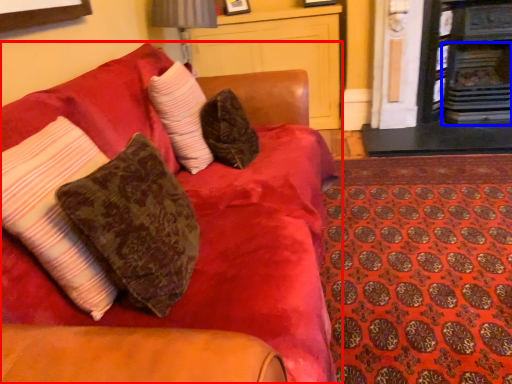
Question: Among these objects, which one is nearest to the camera, studio couch (highlighted by a red box) or fireplace (highlighted by a blue box)?

Choices:
 (A) studio couch
 (B) fireplace

Answer: (A)